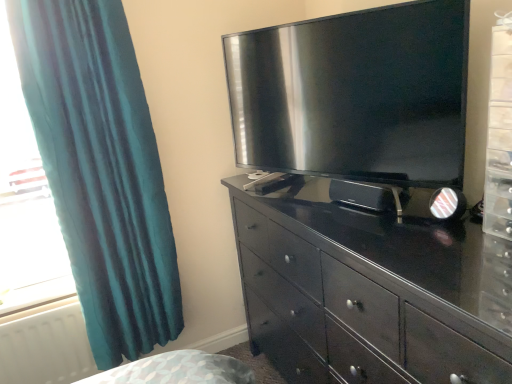
The image size is (512, 384). What are the coordinates of `black glossy television at upper center` in the screenshot? It's located at click(355, 94).

This screenshot has height=384, width=512. Describe the element at coordinates (46, 347) in the screenshot. I see `white matte radiator at lower left` at that location.

Locate an element on the screen. teal fabric curtain at left is located at coordinates (101, 170).

Image resolution: width=512 pixels, height=384 pixels. Find the location of `black glossy television at upper center`. black glossy television at upper center is located at coordinates (355, 94).

Is teal fabric curtain at left inside the boundaries of glossy dark wood chest of drawers at center, or outside?

teal fabric curtain at left is not inside glossy dark wood chest of drawers at center, it's outside.

Considering the sizes of teal fabric curtain at left and glossy dark wood chest of drawers at center in the image, is teal fabric curtain at left wider or thinner than glossy dark wood chest of drawers at center?

In the image, teal fabric curtain at left appears to be more narrow than glossy dark wood chest of drawers at center.

Is teal fabric curtain at left looking in the opposite direction of glossy dark wood chest of drawers at center?

That's not correct — teal fabric curtain at left is not looking away from glossy dark wood chest of drawers at center.

Can you confirm if teal fabric curtain at left is shorter than glossy dark wood chest of drawers at center?

Incorrect, the height of teal fabric curtain at left does not fall short of that of glossy dark wood chest of drawers at center.

Can glossy dark wood chest of drawers at center be found inside white matte radiator at lower left?

No, glossy dark wood chest of drawers at center is located outside of white matte radiator at lower left.

Would you consider white matte radiator at lower left to be distant from glossy dark wood chest of drawers at center?

white matte radiator at lower left is positioned a significant distance from glossy dark wood chest of drawers at center.

Which object is further away from the camera taking this photo, white matte radiator at lower left or glossy dark wood chest of drawers at center?

white matte radiator at lower left is behind.

From the image's perspective, between white matte radiator at lower left and glossy dark wood chest of drawers at center, who is located below?

white matte radiator at lower left, from the image's perspective.

Does white matte radiator at lower left have a greater width compared to teal fabric curtain at left?

No.

Between point (84, 377) and point (158, 295), which one is positioned behind?

Positioned behind is point (84, 377).

From the image's perspective, is white matte radiator at lower left over teal fabric curtain at left?

Incorrect, from the image's perspective, white matte radiator at lower left is lower than teal fabric curtain at left.

Does white matte radiator at lower left have a greater height compared to teal fabric curtain at left?

In fact, white matte radiator at lower left may be shorter than teal fabric curtain at left.

From a real-world perspective, is black glossy television at upper center on teal fabric curtain at left?

Correct, in the physical world, black glossy television at upper center is higher than teal fabric curtain at left.

Is black glossy television at upper center turned away from teal fabric curtain at left?

No, black glossy television at upper center's orientation is not away from teal fabric curtain at left.

Which object is thinner, black glossy television at upper center or teal fabric curtain at left?

black glossy television at upper center.

This screenshot has height=384, width=512. I want to click on curtain below the black glossy television at upper center (from the image's perspective), so pyautogui.click(x=101, y=170).

Based on the photo, considering the sizes of objects black glossy television at upper center and white matte radiator at lower left in the image provided, who is taller, black glossy television at upper center or white matte radiator at lower left?

With more height is black glossy television at upper center.

Is black glossy television at upper center not within white matte radiator at lower left?

Yes, black glossy television at upper center is located beyond the bounds of white matte radiator at lower left.

Does black glossy television at upper center have a smaller size compared to white matte radiator at lower left?

Incorrect, black glossy television at upper center is not smaller in size than white matte radiator at lower left.

Is white matte radiator at lower left not within black glossy television at upper center?

Yes, white matte radiator at lower left is located beyond the bounds of black glossy television at upper center.

Considering the sizes of objects white matte radiator at lower left and black glossy television at upper center in the image provided, who is smaller, white matte radiator at lower left or black glossy television at upper center?

With smaller size is white matte radiator at lower left.

Considering the relative positions of white matte radiator at lower left and black glossy television at upper center in the image provided, is white matte radiator at lower left to the left of black glossy television at upper center from the viewer's perspective?

Indeed, white matte radiator at lower left is positioned on the left side of black glossy television at upper center.

Are white matte radiator at lower left and black glossy television at upper center located far from each other?

Absolutely, white matte radiator at lower left is distant from black glossy television at upper center.

What's the angular difference between glossy dark wood chest of drawers at center and teal fabric curtain at left's facing directions?

The angular difference between glossy dark wood chest of drawers at center and teal fabric curtain at left is 88.5 degrees.

From a real-world perspective, which is physically above, glossy dark wood chest of drawers at center or teal fabric curtain at left?

teal fabric curtain at left is physically above.

Which of these two, glossy dark wood chest of drawers at center or teal fabric curtain at left, is smaller?

teal fabric curtain at left.

Between glossy dark wood chest of drawers at center and teal fabric curtain at left, which one has less height?

glossy dark wood chest of drawers at center.

Find the location of a particular element. Image resolution: width=512 pixels, height=384 pixels. curtain on the left of glossy dark wood chest of drawers at center is located at coordinates pyautogui.click(x=101, y=170).

Identify the location of chest of drawers on the right of white matte radiator at lower left. (369, 292).

Estimate the real-world distances between objects in this image. Which object is further from glossy dark wood chest of drawers at center, white matte radiator at lower left or teal fabric curtain at left?

white matte radiator at lower left is further to glossy dark wood chest of drawers at center.

Which object lies nearer to the anchor point white matte radiator at lower left, glossy dark wood chest of drawers at center or black glossy television at upper center?

Based on the image, glossy dark wood chest of drawers at center appears to be nearer to white matte radiator at lower left.

Based on their spatial positions, is white matte radiator at lower left or black glossy television at upper center closer to teal fabric curtain at left?

white matte radiator at lower left is closer to teal fabric curtain at left.

Looking at the image, which one is located further to black glossy television at upper center, white matte radiator at lower left or teal fabric curtain at left?

white matte radiator at lower left is positioned further to the anchor black glossy television at upper center.

Which object lies further to the anchor point white matte radiator at lower left, teal fabric curtain at left or glossy dark wood chest of drawers at center?

glossy dark wood chest of drawers at center.

When comparing their distances from teal fabric curtain at left, does white matte radiator at lower left or glossy dark wood chest of drawers at center seem closer?

The object closer to teal fabric curtain at left is white matte radiator at lower left.

Based on their spatial positions, is teal fabric curtain at left or black glossy television at upper center further from glossy dark wood chest of drawers at center?

teal fabric curtain at left is positioned further to the anchor glossy dark wood chest of drawers at center.

Estimate the real-world distances between objects in this image. Which object is closer to white matte radiator at lower left, black glossy television at upper center or glossy dark wood chest of drawers at center?

glossy dark wood chest of drawers at center is closer to white matte radiator at lower left.

Find the location of a particular element. The image size is (512, 384). curtain between white matte radiator at lower left and glossy dark wood chest of drawers at center is located at coordinates (101, 170).

Find the location of a particular element. television situated between white matte radiator at lower left and glossy dark wood chest of drawers at center from left to right is located at coordinates (355, 94).

Locate an element on the screen. curtain situated between white matte radiator at lower left and black glossy television at upper center from left to right is located at coordinates [x=101, y=170].

This screenshot has width=512, height=384. I want to click on television between teal fabric curtain at left and glossy dark wood chest of drawers at center from left to right, so click(355, 94).